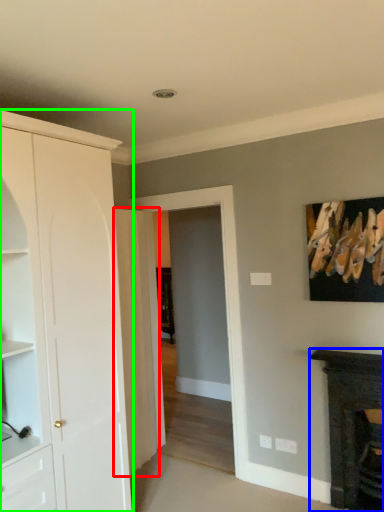
Question: Based on their relative distances, which object is nearer to door (highlighted by a red box)? Choose from fireplace (highlighted by a blue box) and cabinetry (highlighted by a green box).

Choices:
 (A) fireplace
 (B) cabinetry

Answer: (B)